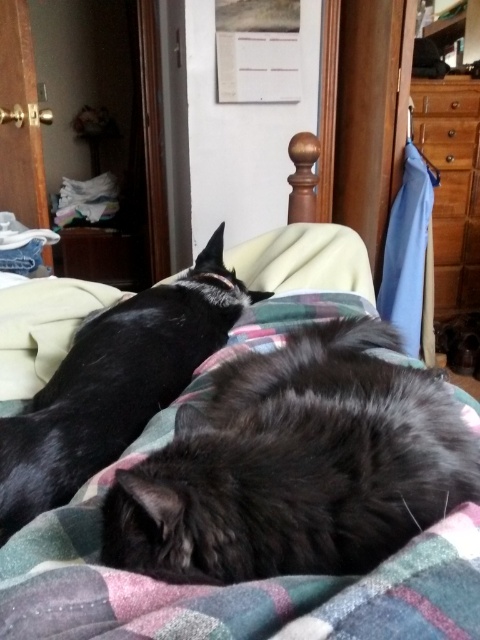
Question: Is fluffy black cat at center below shiny black cat at left?

Choices:
 (A) yes
 (B) no

Answer: (A)

Question: Which of the following is the closest to the observer?

Choices:
 (A) fluffy black cat at center
 (B) shiny black cat at left

Answer: (A)

Question: Can you confirm if fluffy black cat at center is smaller than shiny black cat at left?

Choices:
 (A) yes
 (B) no

Answer: (A)

Question: Which of the following is the farthest from the observer?

Choices:
 (A) shiny black cat at left
 (B) fluffy black cat at center

Answer: (A)

Question: Is fluffy black cat at center smaller than shiny black cat at left?

Choices:
 (A) no
 (B) yes

Answer: (B)

Question: Which of the following is the farthest from the observer?

Choices:
 (A) shiny black cat at left
 (B) fluffy black cat at center

Answer: (A)